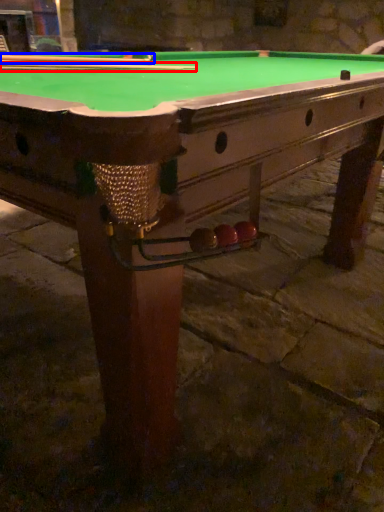
Question: Which object is further to the camera taking this photo, cue (highlighted by a red box) or cue (highlighted by a blue box)?

Choices:
 (A) cue
 (B) cue

Answer: (A)